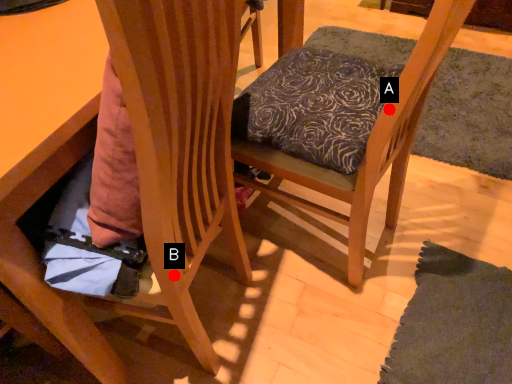
Question: Two points are circled on the image, labeled by A and B beside each circle. Which point appears closest to the camera in this image?

Choices:
 (A) A is closer
 (B) B is closer

Answer: (B)